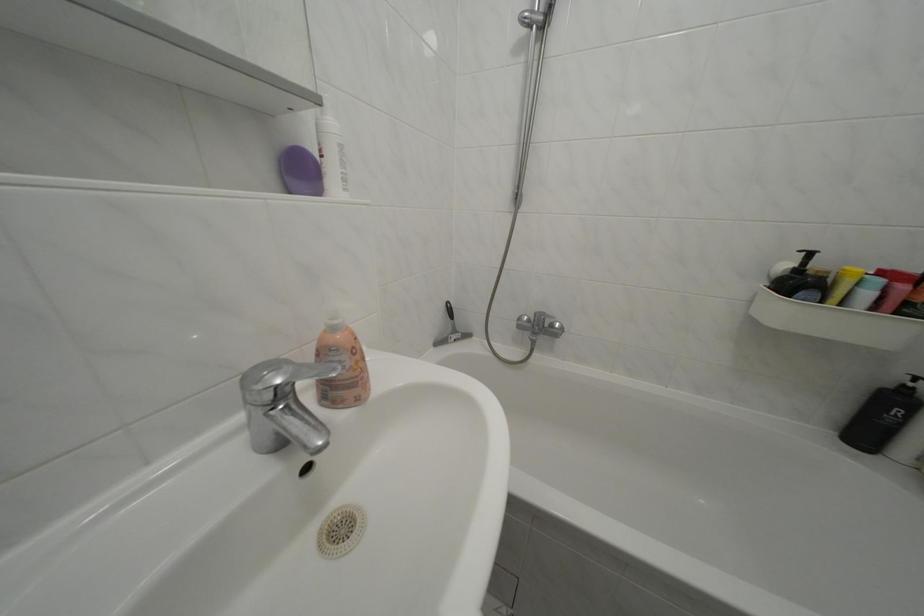
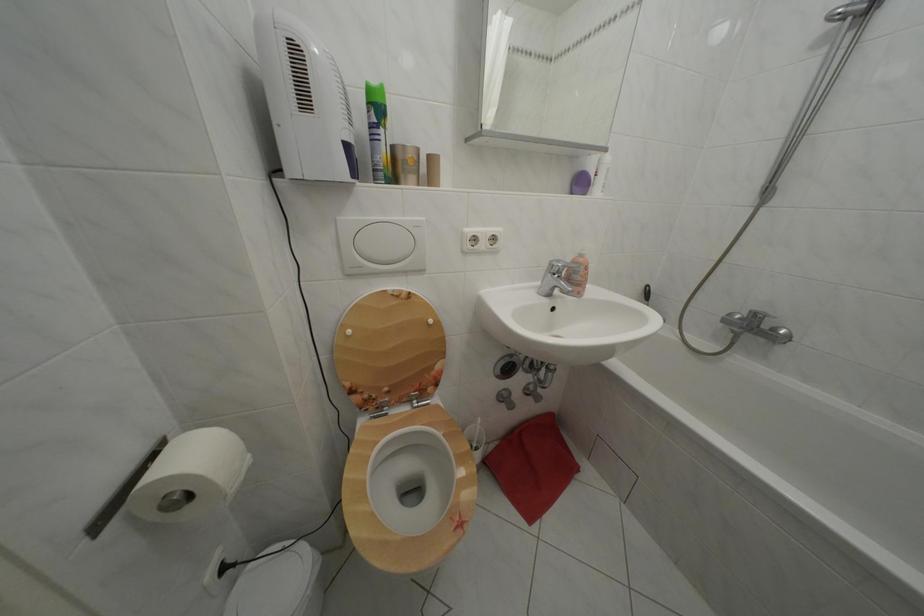
Where in the second image is the point corresponding to point (562, 331) from the first image?

(783, 336)